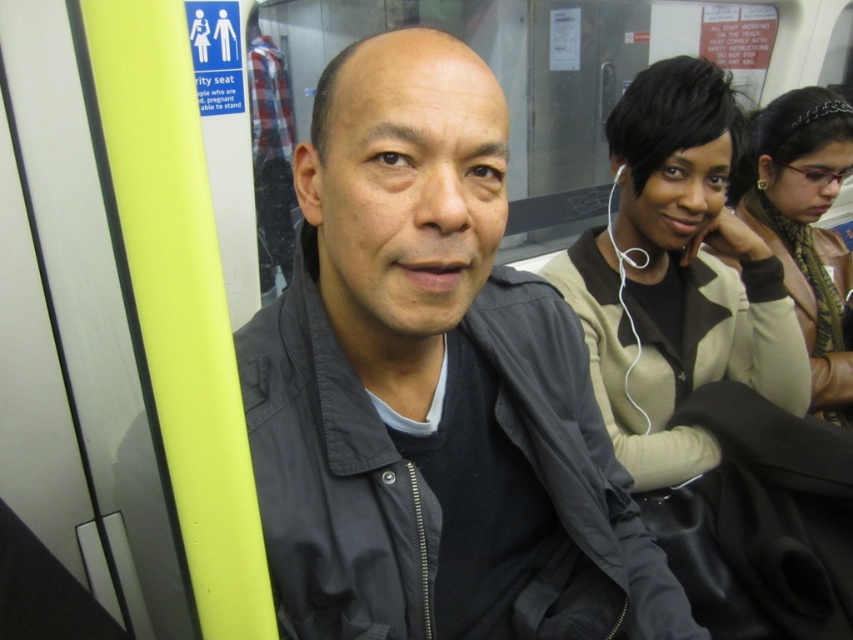
Is beige fabric jacket at center below brown textured scarf at upper right?

Indeed, beige fabric jacket at center is positioned under brown textured scarf at upper right.

Between beige fabric jacket at center and brown textured scarf at upper right, which one is positioned lower?

beige fabric jacket at center

Which is behind, point (741, 141) or point (750, 225)?

The point (750, 225) is more distant.

Identify the location of beige fabric jacket at center. The image size is (853, 640). (677, 276).

Is dark gray jacket at center thinner than beige fabric jacket at center?

No.

Does dark gray jacket at center have a greater height compared to beige fabric jacket at center?

Incorrect, dark gray jacket at center's height is not larger of beige fabric jacket at center's.

Identify the location of dark gray jacket at center. (424, 368).

Identify the location of dark gray jacket at center. The height and width of the screenshot is (640, 853). (424, 368).

Does point (544, 602) come in front of point (808, 134)?

Yes, it is in front of point (808, 134).

Find the location of a particular element. Image resolution: width=853 pixels, height=640 pixels. dark gray jacket at center is located at coordinates (424, 368).